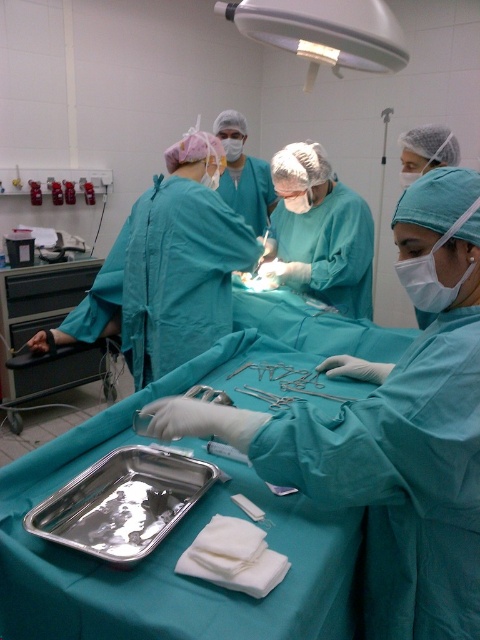
Question: Which of the following is the farthest from the observer?

Choices:
 (A) satin silver scissors at center
 (B) teal matte surgical gown at center
 (C) silver metallic tray at lower left

Answer: (A)

Question: Which point appears closest to the camera in this image?

Choices:
 (A) (247, 392)
 (B) (153, 515)
 (C) (427, 545)

Answer: (C)

Question: Where is silver metallic tray at lower left located in relation to satin silver scissors at center in the image?

Choices:
 (A) above
 (B) below

Answer: (B)

Question: From the image, what is the correct spatial relationship of silver metallic tray at lower left in relation to satin silver scissors at center?

Choices:
 (A) above
 (B) below

Answer: (B)

Question: Is silver metallic tray at lower left positioned at the back of satin silver metal forceps at center?

Choices:
 (A) yes
 (B) no

Answer: (B)

Question: Which of the following is the farthest from the observer?

Choices:
 (A) silver metallic tray at lower left
 (B) satin silver metal forceps at center
 (C) satin silver scissors at center
 (D) teal matte surgical gown at center

Answer: (B)